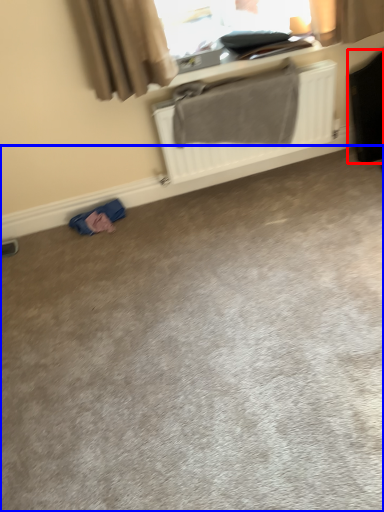
Question: Which point is closer to the camera, luggage (highlighted by a red box) or concrete (highlighted by a blue box)?

Choices:
 (A) luggage
 (B) concrete

Answer: (B)